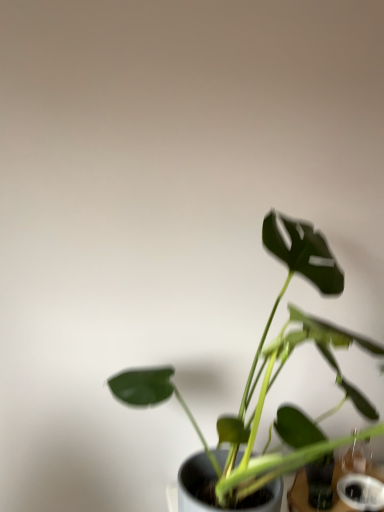
In order to face green matte plant at center, should I rotate leftwards or rightwards?

Turn right by 13.881 degrees to look at green matte plant at center.

This screenshot has width=384, height=512. Describe the element at coordinates (270, 371) in the screenshot. I see `green matte plant at center` at that location.

Where is `green matte plant at center`? green matte plant at center is located at coordinates (270, 371).

Identify the location of green matte plant at center. The height and width of the screenshot is (512, 384). (270, 371).